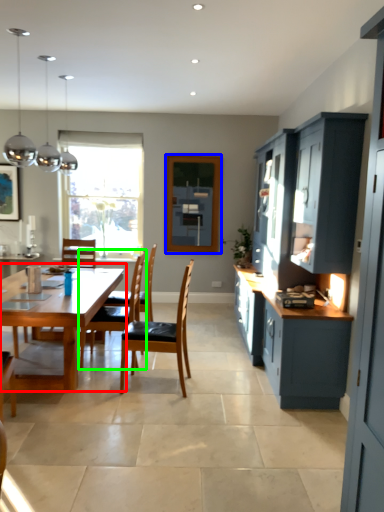
Question: Considering the real-world distances, which object is farthest from kitchen & dining room table (highlighted by a red box)? window screen (highlighted by a blue box) or chair (highlighted by a green box)?

Choices:
 (A) window screen
 (B) chair

Answer: (A)